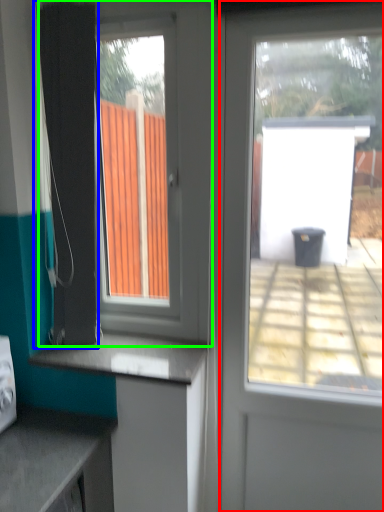
Question: Estimate the real-world distances between objects in this image. Which object is closer to door (highlighted by a red box), shower curtain (highlighted by a blue box) or window (highlighted by a green box)?

Choices:
 (A) shower curtain
 (B) window

Answer: (B)